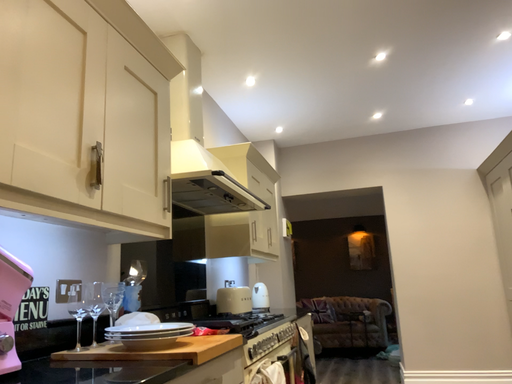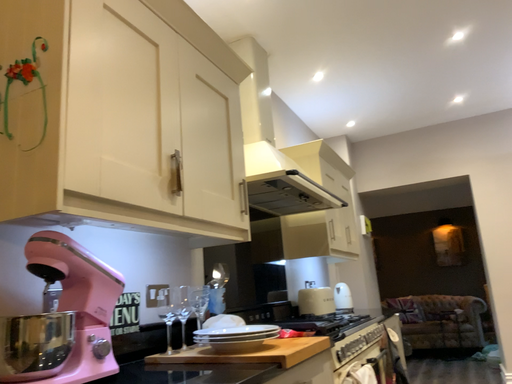
Question: Which way did the camera rotate in the video?

Choices:
 (A) rotated right
 (B) rotated left

Answer: (B)